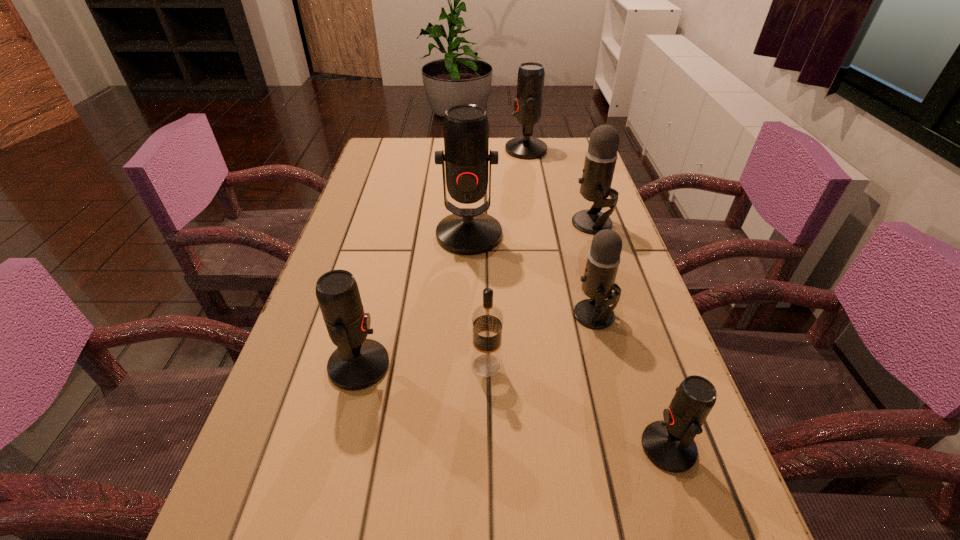
Choose which microphone is the third nearest neighbor to the shortest microphone. Please provide its 2D coordinates. Your answer should be formatted as a tuple, i.e. [(x, y)], where the tuple contains the x and y coordinates of a point satisfying the conditions above.

[(468, 231)]

Identify which red microphone is the third nearest to the third nearest microphone. Please provide its 2D coordinates. Your answer should be formatted as a tuple, i.e. [(x, y)], where the tuple contains the x and y coordinates of a point satisfying the conditions above.

[(358, 363)]

You are a GUI agent. You are given a task and a screenshot of the screen. Output one action in this format:
    pyautogui.click(x=<x>, y=<y>)
    Task: Click on the red microphone identified as the second closest to the nearer gray microphone
    The width and height of the screenshot is (960, 540).
    Given the screenshot: What is the action you would take?
    pyautogui.click(x=468, y=231)

Identify which gray microphone is located as the second nearest to the vodka. Please provide its 2D coordinates. Your answer should be formatted as a tuple, i.e. [(x, y)], where the tuple contains the x and y coordinates of a point satisfying the conditions above.

[(601, 155)]

At what (x,y) coordinates should I click in order to perform the action: click on free space that satisfies the following two spatial constraints: 1. on the front side of the smaller gray microphone; 2. on the side of the second nearest microphone with the red ring. Please return your answer as a coordinate pair (x, y). The image size is (960, 540). Looking at the image, I should click on (608, 366).

Identify the location of free location that satisfies the following two spatial constraints: 1. on the front side of the farther gray microphone; 2. on the side of the leftmost microphone with the red ring. (638, 366).

This screenshot has width=960, height=540. In order to click on vacant space that satisfies the following two spatial constraints: 1. on the back side of the farther gray microphone; 2. on the left side of the smaller gray microphone in this screenshot , I will do click(570, 224).

Locate an element on the screen. This screenshot has height=540, width=960. vacant space that satisfies the following two spatial constraints: 1. on the front side of the bigger gray microphone; 2. on the side of the leftmost microphone with the red ring is located at coordinates (638, 366).